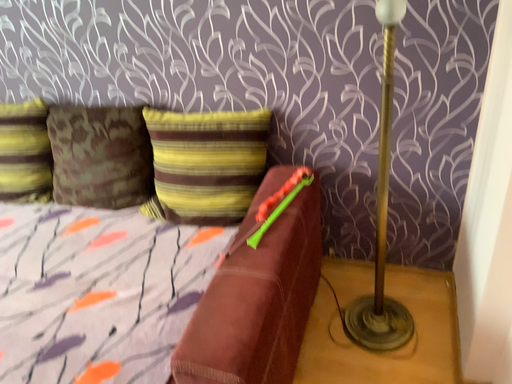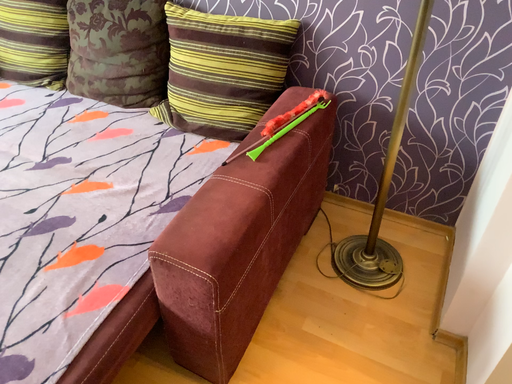
Question: How did the camera likely rotate when shooting the video?

Choices:
 (A) rotated upward
 (B) rotated downward

Answer: (B)